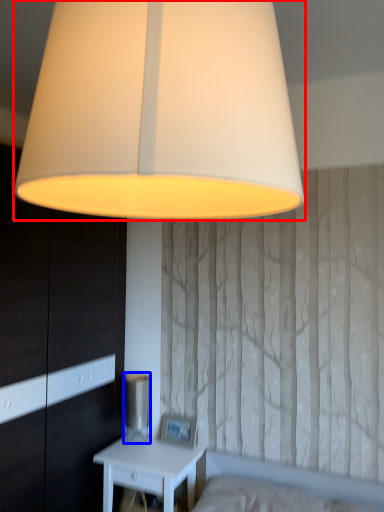
Question: Which of the following is the closest to the observer, lamp (highlighted by a red box) or table lamp (highlighted by a blue box)?

Choices:
 (A) lamp
 (B) table lamp

Answer: (A)